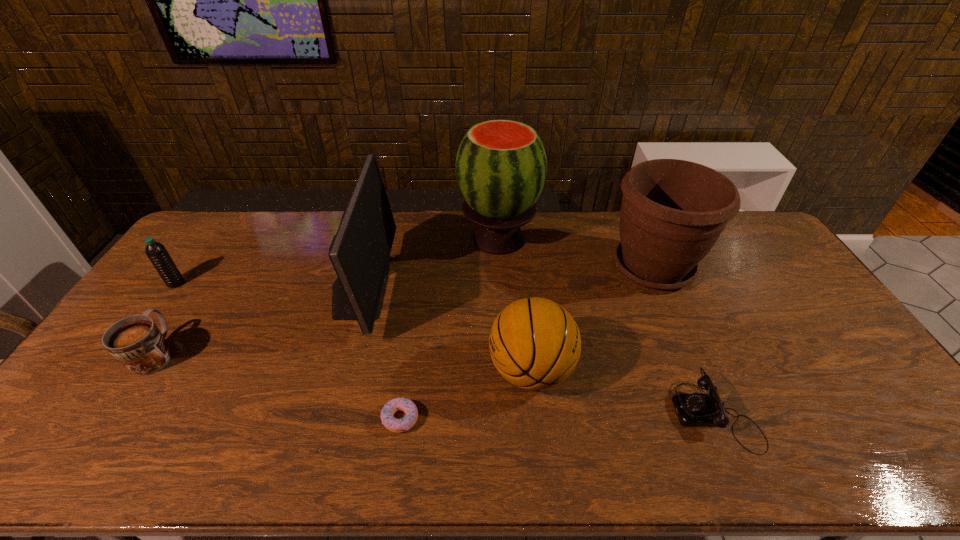
Find the location of a particular element. This screenshot has height=540, width=960. vacant area that lies between the telephone and the fifth object from right to left is located at coordinates (558, 416).

You are a GUI agent. You are given a task and a screenshot of the screen. Output one action in this format:
    pyautogui.click(x=<x>, y=<y>)
    Task: Click on the unoccupied area between the flowerpot and the second object from left to right
    This screenshot has width=960, height=540.
    Given the screenshot: What is the action you would take?
    pyautogui.click(x=405, y=310)

At what (x,y) coordinates should I click in order to perform the action: click on unoccupied position between the flowerpot and the watermelon. Please return your answer as a coordinate pair (x, y). Looking at the image, I should click on (x=576, y=253).

Where is `vacant region between the fourth object from left to right and the tallest object`? This screenshot has height=540, width=960. vacant region between the fourth object from left to right and the tallest object is located at coordinates (449, 329).

Find the location of a particular element. the closest object to the telephone is located at coordinates (535, 344).

Locate an element on the screen. The width and height of the screenshot is (960, 540). the seventh closest object relative to the fourth tallest object is located at coordinates (156, 252).

Where is `vacant space that satisfies the following two spatial constraints: 1. on the front side of the flowerpot; 2. on the front-facing side of the telephone`? vacant space that satisfies the following two spatial constraints: 1. on the front side of the flowerpot; 2. on the front-facing side of the telephone is located at coordinates (717, 414).